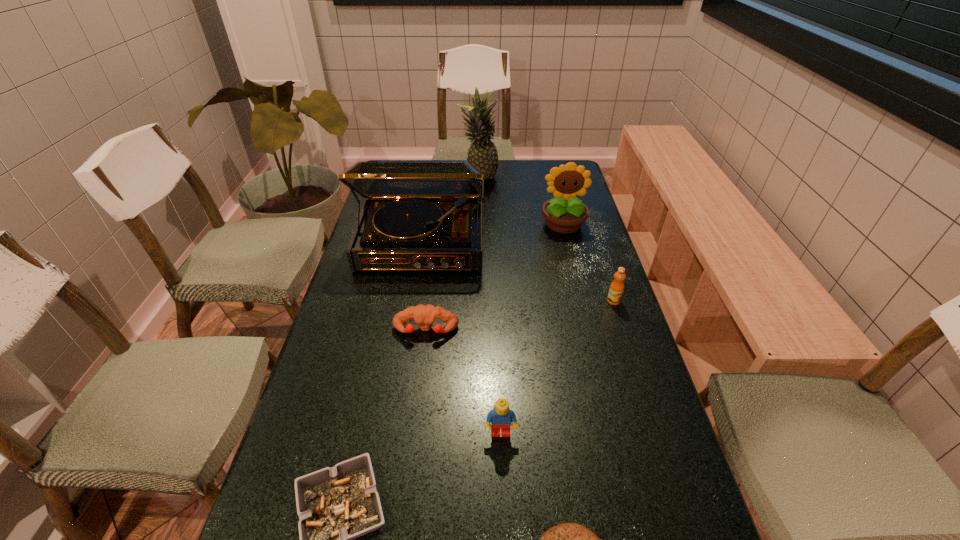
In order to click on pineapple in this screenshot , I will do `click(482, 155)`.

Where is `record player`? This screenshot has height=540, width=960. record player is located at coordinates (418, 215).

This screenshot has height=540, width=960. I want to click on sunflower, so click(564, 214).

Where is `orange juice`? The height and width of the screenshot is (540, 960). orange juice is located at coordinates (616, 289).

The width and height of the screenshot is (960, 540). I want to click on the third nearest object, so click(x=501, y=416).

You are a GUI agent. You are given a task and a screenshot of the screen. Output one action in this format:
    pyautogui.click(x=<x>, y=<y>)
    Task: Click on the puncher
    This screenshot has width=960, height=540.
    Given the screenshot: What is the action you would take?
    pyautogui.click(x=424, y=316)

The height and width of the screenshot is (540, 960). Find the location of `the fifth farthest object`. the fifth farthest object is located at coordinates pos(424,316).

Locate an element on the screen. This screenshot has height=540, width=960. vacant space situated 0.250m on the left of the pineapple is located at coordinates (396, 179).

At what (x,y) coordinates should I click in order to perform the action: click on vacant region located 0.050m on the front-facing side of the record player. Please return your answer as a coordinate pair (x, y). Looking at the image, I should click on (414, 289).

This screenshot has width=960, height=540. I want to click on vacant space situated 0.240m on the face of the sixth shortest object, so click(x=578, y=286).